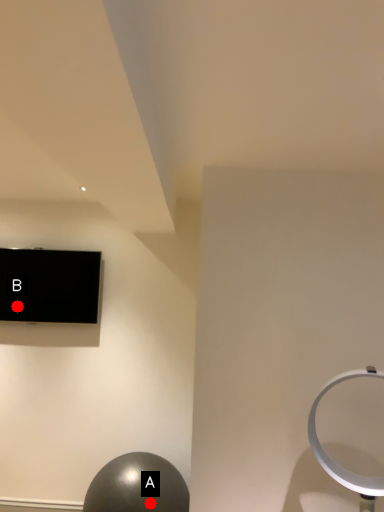
Question: Two points are circled on the image, labeled by A and B beside each circle. Among these points, which one is farthest from the camera?

Choices:
 (A) A is further
 (B) B is further

Answer: (B)